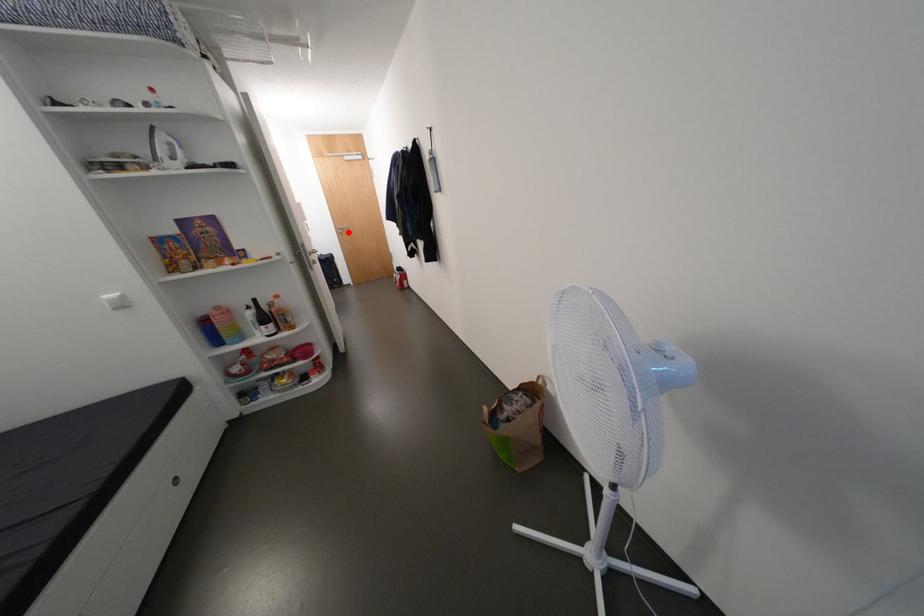
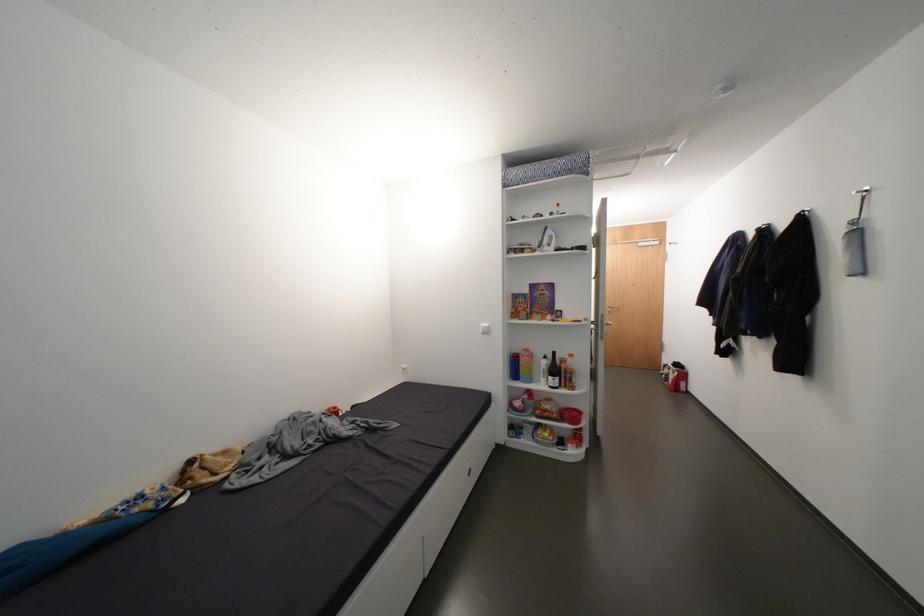
In the second image, find the point that corresponds to the highlighted location in the first image.

(616, 310)